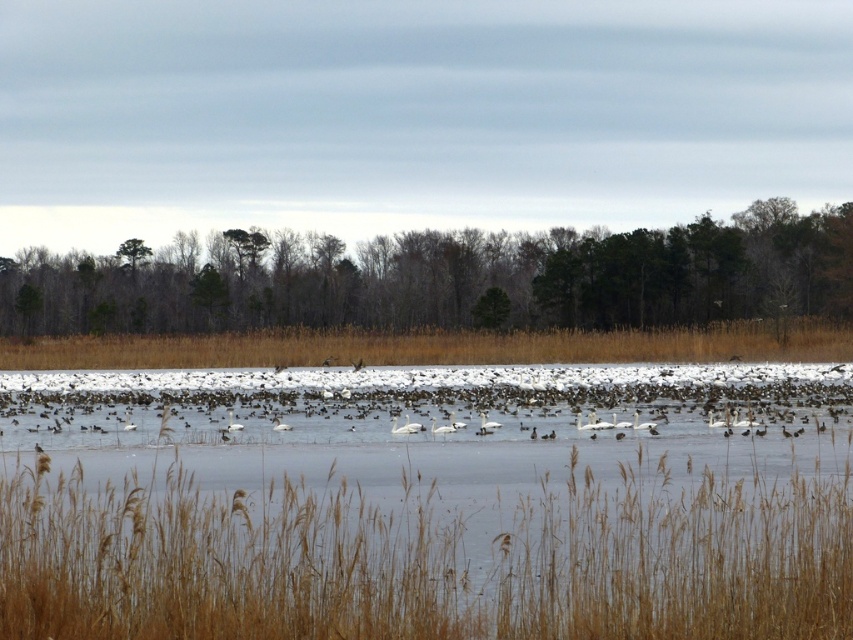
You are a photographer aiming to capture the entire scene in one shot. Given that the brown dry grass at lower center is wider than the white matte swan at center, will you need to adjust your camera angle to ensure both fit in the frame?

The brown dry grass at lower center is wider than the white matte swan at center. To capture both in one shot, you may need to adjust your camera angle to accommodate the wider width of the brown dry grass at lower center.

You are standing at the center of the image and want to locate the white glossy swan at center. According to the coordinates provided, in which direction should you look to find it?

The white glossy swan at center is located at coordinates 0.669 on the x axis and 0.474 on the y axis. Since the center of the image is at 0.5 on both axes, the swan is to the right and slightly above the center point.